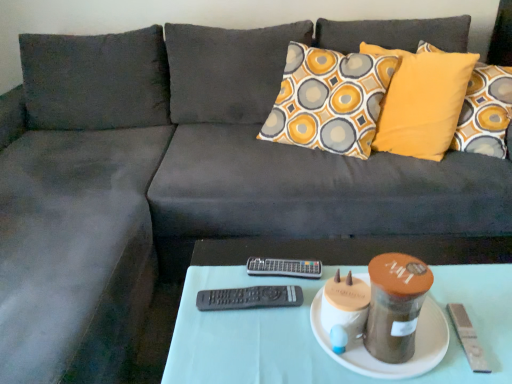
The width and height of the screenshot is (512, 384). What are the coordinates of `vacant location behind black plastic remote at center, the second remote when ordered from back to front` in the screenshot? It's located at (242, 263).